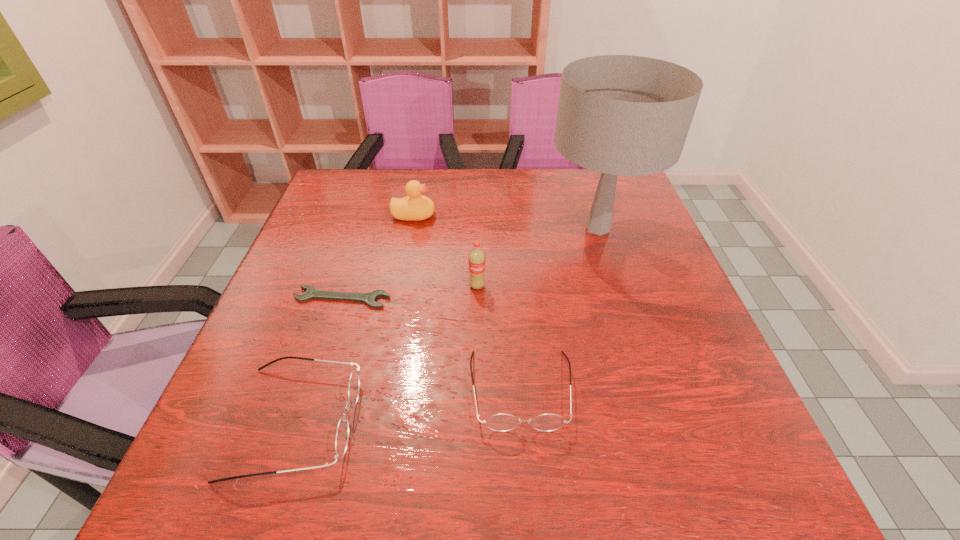
Where is `free space located on the right of the wrench`? This screenshot has width=960, height=540. free space located on the right of the wrench is located at coordinates (418, 298).

Where is `vacant space located on the face of the third tallest object`? The height and width of the screenshot is (540, 960). vacant space located on the face of the third tallest object is located at coordinates (460, 215).

This screenshot has width=960, height=540. I want to click on vacant region located 0.260m on the front-facing side of the rightmost object, so click(636, 348).

At what (x,y) coordinates should I click in order to perform the action: click on free space located on the left of the soda. Please return your answer as a coordinate pair (x, y). The image size is (960, 540). Looking at the image, I should click on (300, 286).

Locate an element on the screen. duck located at the far edge is located at coordinates (415, 207).

This screenshot has width=960, height=540. Identify the location of lampshade that is positioned at the far edge. (627, 115).

Where is `spectacles at the left edge`? This screenshot has height=540, width=960. spectacles at the left edge is located at coordinates (342, 433).

Where is `wrench located in the left edge section of the desktop`? The height and width of the screenshot is (540, 960). wrench located in the left edge section of the desktop is located at coordinates (370, 298).

The height and width of the screenshot is (540, 960). What are the coordinates of `object positioned at the right edge` in the screenshot? It's located at (627, 115).

The width and height of the screenshot is (960, 540). I want to click on object present at the near left corner, so click(342, 433).